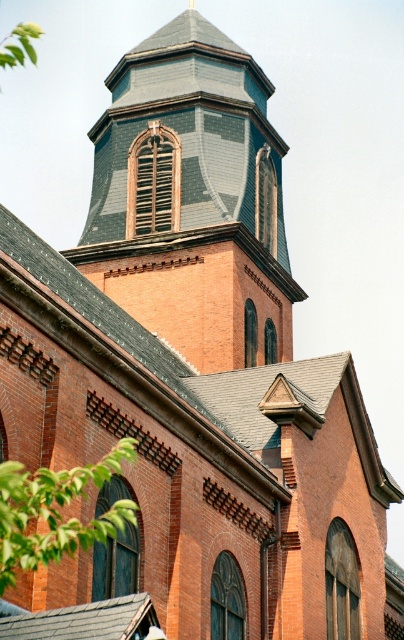
Question: Does gray slate roof at upper center have a greater width compared to green leafy tree at lower left?

Choices:
 (A) no
 (B) yes

Answer: (B)

Question: Can you confirm if gray slate roof at upper center is wider than green leafy tree at lower left?

Choices:
 (A) no
 (B) yes

Answer: (B)

Question: Which of the following is the closest to the observer?

Choices:
 (A) (157, 84)
 (B) (37, 522)

Answer: (B)

Question: Which of the following is the closest to the observer?

Choices:
 (A) green leafy tree at lower left
 (B) gray slate roof at upper center

Answer: (A)

Question: Where is gray slate roof at upper center located in relation to green leafy tree at lower left in the image?

Choices:
 (A) left
 (B) right

Answer: (B)